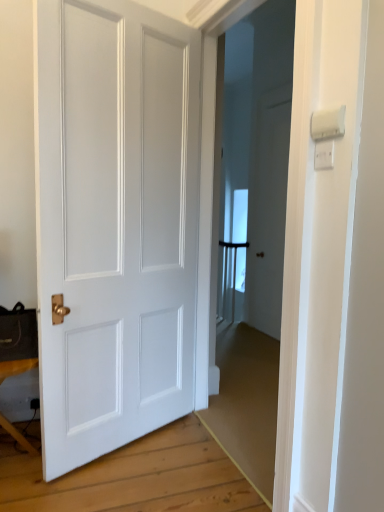
Question: Is white plastic light switch at upper right, which is the first light switch from top to bottom, bigger than white plastic light switch at upper right, the first light switch in the bottom-to-top sequence?

Choices:
 (A) yes
 (B) no

Answer: (A)

Question: Does white plastic light switch at upper right, which is the first light switch from top to bottom, turn towards white plastic light switch at upper right, the first light switch in the bottom-to-top sequence?

Choices:
 (A) yes
 (B) no

Answer: (B)

Question: Does white plastic light switch at upper right, which is the first light switch from top to bottom, have a greater height compared to white plastic light switch at upper right, the first light switch in the bottom-to-top sequence?

Choices:
 (A) yes
 (B) no

Answer: (A)

Question: From a real-world perspective, does white plastic light switch at upper right, which is the first light switch from top to bottom, stand above white plastic light switch at upper right, the first light switch in the bottom-to-top sequence?

Choices:
 (A) no
 (B) yes

Answer: (B)

Question: Is white plastic light switch at upper right, which is the first light switch from top to bottom, directly adjacent to white plastic light switch at upper right, the first light switch in the bottom-to-top sequence?

Choices:
 (A) no
 (B) yes

Answer: (B)

Question: From a real-world perspective, is wooden table at lower left positioned above or below white matte door at center?

Choices:
 (A) above
 (B) below

Answer: (B)

Question: Visually, is wooden table at lower left positioned to the left or to the right of white matte door at center?

Choices:
 (A) right
 (B) left

Answer: (B)

Question: Considering the positions of wooden table at lower left and white matte door at center in the image, is wooden table at lower left wider or thinner than white matte door at center?

Choices:
 (A) thin
 (B) wide

Answer: (B)

Question: Is wooden table at lower left situated inside white matte door at center or outside?

Choices:
 (A) inside
 (B) outside

Answer: (B)

Question: Is white plastic light switch at upper right, which is the second light switch in top-to-bottom order, inside the boundaries of white plastic light switch at upper right, placed as the second light switch when sorted from bottom to top, or outside?

Choices:
 (A) inside
 (B) outside

Answer: (B)

Question: From their relative heights in the image, would you say white plastic light switch at upper right, which is the second light switch in top-to-bottom order, is taller or shorter than white plastic light switch at upper right, placed as the second light switch when sorted from bottom to top?

Choices:
 (A) tall
 (B) short

Answer: (B)

Question: In the image, is white plastic light switch at upper right, the first light switch in the bottom-to-top sequence, on the left side or the right side of white plastic light switch at upper right, placed as the second light switch when sorted from bottom to top?

Choices:
 (A) left
 (B) right

Answer: (B)

Question: Is point (332, 152) positioned closer to the camera than point (314, 134)?

Choices:
 (A) farther
 (B) closer

Answer: (B)

Question: From the image's perspective, is white plastic light switch at upper right, the first light switch in the bottom-to-top sequence, located above or below wooden table at lower left?

Choices:
 (A) above
 (B) below

Answer: (A)

Question: From a real-world perspective, relative to wooden table at lower left, is white plastic light switch at upper right, which is the second light switch in top-to-bottom order, vertically above or below?

Choices:
 (A) below
 (B) above

Answer: (B)